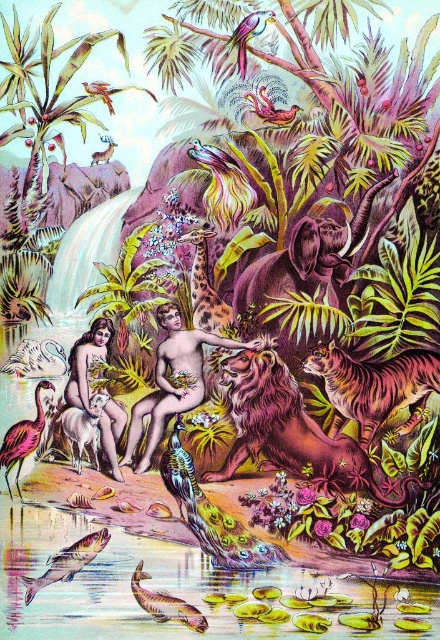
Can you confirm if orange striped tiger at center right is taller than matte skin nude at center?

No, orange striped tiger at center right is not taller than matte skin nude at center.

Can you confirm if orange striped tiger at center right is thinner than matte skin nude at center?

In fact, orange striped tiger at center right might be wider than matte skin nude at center.

Locate an element on the screen. The height and width of the screenshot is (640, 440). orange striped tiger at center right is located at coordinates (374, 387).

At what (x,y) coordinates should I click in order to perform the action: click on orange striped tiger at center right. Please return your answer as a coordinate pair (x, y). This screenshot has height=640, width=440. Looking at the image, I should click on (374, 387).

Does matte skin nude at center have a larger size compared to pink feathered bird at lower left?

Yes, matte skin nude at center is bigger than pink feathered bird at lower left.

Between point (87, 339) and point (7, 460), which one is positioned behind?

Positioned behind is point (87, 339).

Identify the location of matte skin nude at center. The height and width of the screenshot is (640, 440). (88, 362).

Which is behind, point (70, 364) or point (197, 628)?

The point (70, 364) is more distant.

In order to click on matte skin nude at center in this screenshot , I will do `click(88, 362)`.